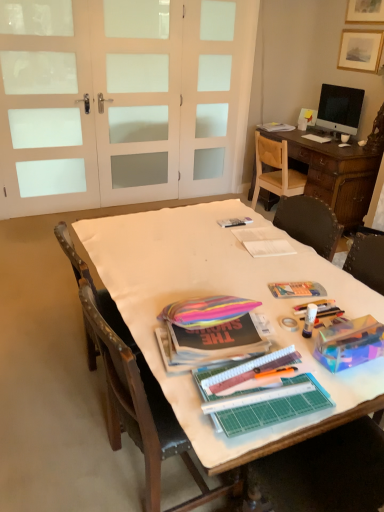
Question: Which direction should I rotate to look at rainbow fabric bag at center, which is counted as the third magazine, starting from the back?

Choices:
 (A) left
 (B) right

Answer: (B)

Question: Considering the relative sizes of white fabric-covered table at center and wooden chair at right, the 2th chair viewed from the left, in the image provided, is white fabric-covered table at center smaller than wooden chair at right, the 2th chair viewed from the left,?

Choices:
 (A) yes
 (B) no

Answer: (B)

Question: Is white fabric-covered table at center facing away from wooden chair at right, the 1th chair viewed from the right?

Choices:
 (A) no
 (B) yes

Answer: (A)

Question: From a real-world perspective, is white fabric-covered table at center under wooden chair at right, the 1th chair viewed from the right?

Choices:
 (A) no
 (B) yes

Answer: (B)

Question: Is white fabric-covered table at center at the left side of wooden chair at right, arranged as the 1th chair when viewed from the back?

Choices:
 (A) yes
 (B) no

Answer: (A)

Question: Is white fabric-covered table at center at the right side of wooden chair at right, the 2th chair viewed from the left?

Choices:
 (A) no
 (B) yes

Answer: (A)

Question: Can wooden chair at right, which is the 2th chair from bottom to top, be found inside white fabric-covered table at center?

Choices:
 (A) yes
 (B) no

Answer: (B)

Question: Would you say wooden picture frame at upper right is part of white fabric-covered table at center's contents?

Choices:
 (A) no
 (B) yes

Answer: (A)

Question: Can you confirm if white fabric-covered table at center is wider than wooden picture frame at upper right?

Choices:
 (A) yes
 (B) no

Answer: (A)

Question: Could you tell me if white fabric-covered table at center is facing wooden picture frame at upper right?

Choices:
 (A) no
 (B) yes

Answer: (A)

Question: Is white fabric-covered table at center beside wooden picture frame at upper right?

Choices:
 (A) yes
 (B) no

Answer: (B)

Question: Can you confirm if white fabric-covered table at center is taller than wooden picture frame at upper right?

Choices:
 (A) no
 (B) yes

Answer: (B)

Question: Can you confirm if white fabric-covered table at center is bigger than wooden picture frame at upper right?

Choices:
 (A) no
 (B) yes

Answer: (B)

Question: Is white frosted glass screen door at upper center, which is the third screen door from left to right, smaller than white fabric-covered table at center?

Choices:
 (A) yes
 (B) no

Answer: (A)